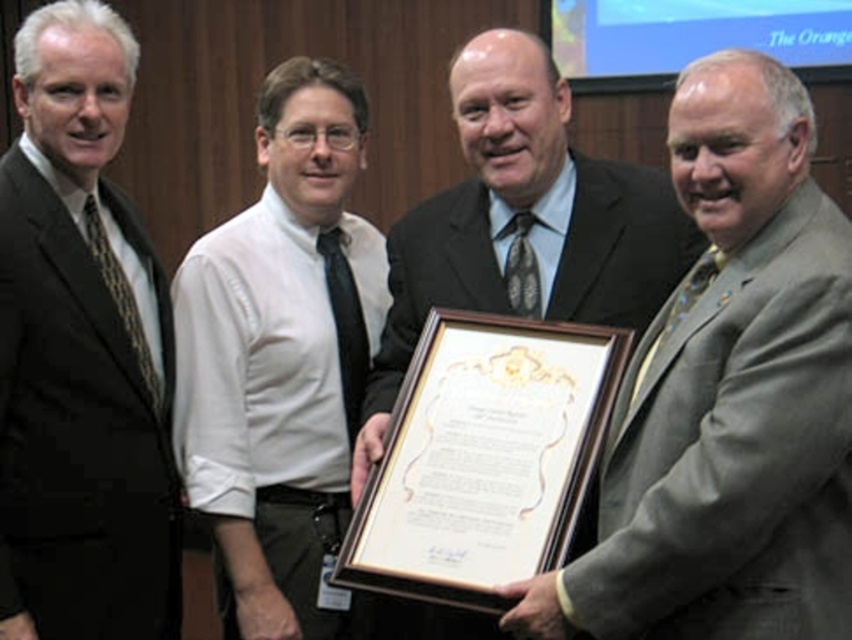
From the picture: Which is more to the left, gray wool suit at right or matte black suit at left?

From the viewer's perspective, matte black suit at left appears more on the left side.

Which is in front, point (769, 394) or point (88, 100)?

Point (769, 394) is more forward.

You are a GUI agent. You are given a task and a screenshot of the screen. Output one action in this format:
    pyautogui.click(x=<x>, y=<y>)
    Task: Click on the gray wool suit at right
    This screenshot has width=852, height=640.
    Given the screenshot: What is the action you would take?
    pyautogui.click(x=734, y=451)

Consider the image. Is matte black suit at left closer to camera compared to white shirt at center?

Yes, it is.

Can you confirm if matte black suit at left is wider than white shirt at center?

Incorrect, matte black suit at left's width does not surpass white shirt at center's.

The image size is (852, 640). What do you see at coordinates (79, 353) in the screenshot?
I see `matte black suit at left` at bounding box center [79, 353].

Where is `matte black suit at left`? This screenshot has height=640, width=852. matte black suit at left is located at coordinates [x=79, y=353].

Who is shorter, white shirt at center or matte black suit at center?

matte black suit at center

Does white shirt at center appear on the right side of matte black suit at center?

No, white shirt at center is not to the right of matte black suit at center.

The image size is (852, 640). Identify the location of white shirt at center. (281, 358).